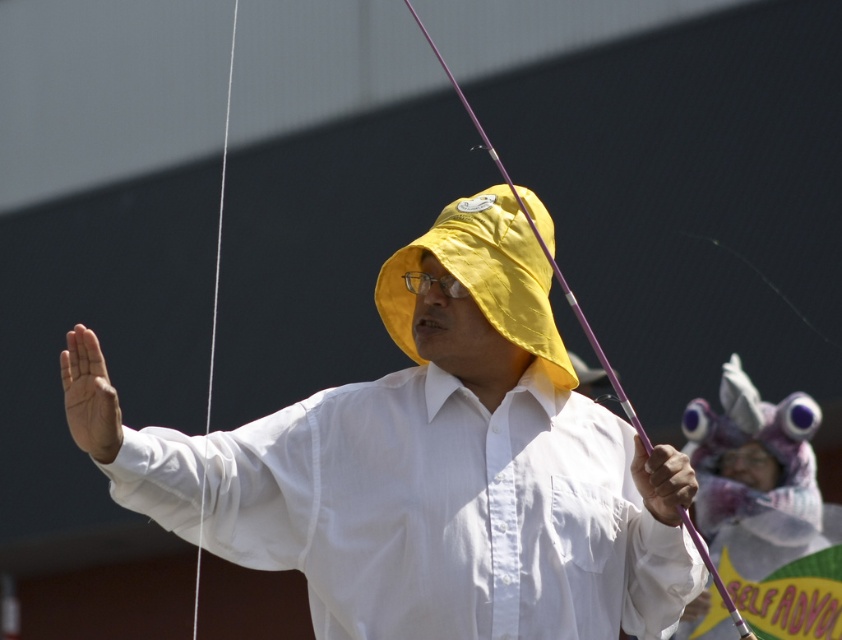
Between point (408, 353) and point (544, 246), which one is positioned behind?

The point (408, 353) is behind.

Can you confirm if yellow fabric hat at center is shorter than purple glossy fishing pole at center?

Indeed, yellow fabric hat at center has a lesser height compared to purple glossy fishing pole at center.

Does point (480, 195) lie in front of point (446, 74)?

Yes, point (480, 195) is closer to viewer.

The height and width of the screenshot is (640, 842). I want to click on yellow fabric hat at center, so click(x=482, y=276).

How far apart are yellow fabric hat at center and white string at left?

yellow fabric hat at center and white string at left are 8.46 meters apart from each other.

Measure the distance from yellow fabric hat at center to white string at left.

yellow fabric hat at center is 8.46 meters away from white string at left.

Is point (416, 262) less distant than point (226, 96)?

That is True.

At what (x,y) coordinates should I click in order to perform the action: click on yellow fabric hat at center. Please return your answer as a coordinate pair (x, y). The height and width of the screenshot is (640, 842). Looking at the image, I should click on (482, 276).

Does purple glossy fishing pole at center appear under white string at left?

Yes.

Between purple glossy fishing pole at center and white string at left, which one has less height?

Standing shorter between the two is purple glossy fishing pole at center.

Does point (739, 620) lie in front of point (232, 20)?

Yes, it is.

Where is `purple glossy fishing pole at center`? purple glossy fishing pole at center is located at coordinates (542, 248).